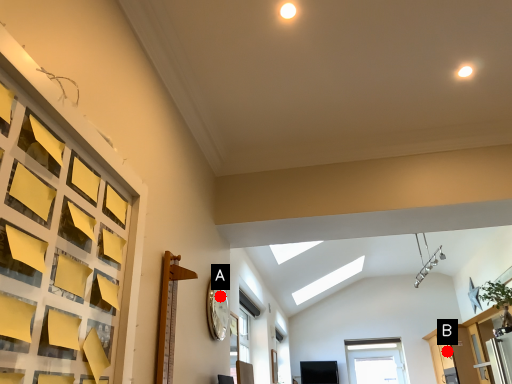
Question: Two points are circled on the image, labeled by A and B beside each circle. Which of the following is the closest to the observer?

Choices:
 (A) A is closer
 (B) B is closer

Answer: (A)